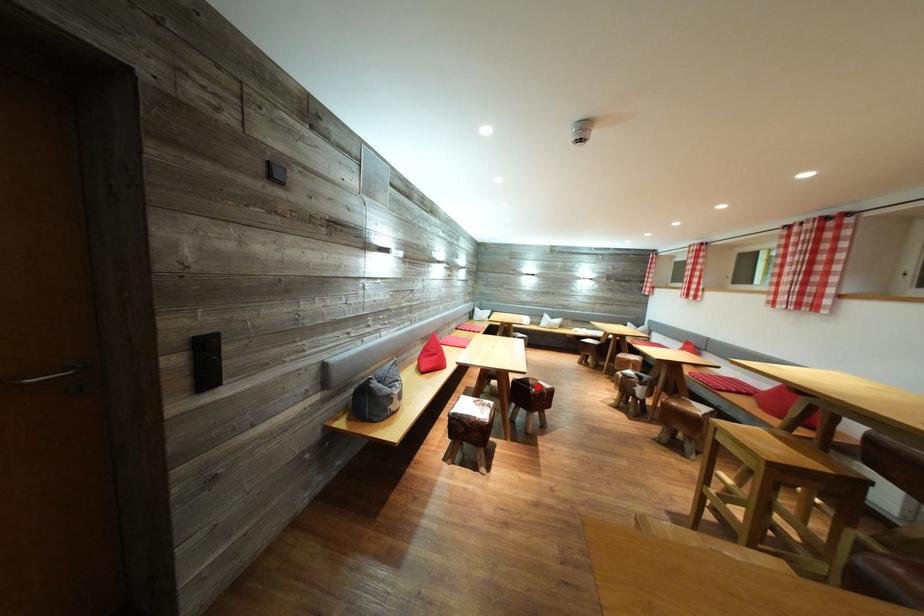
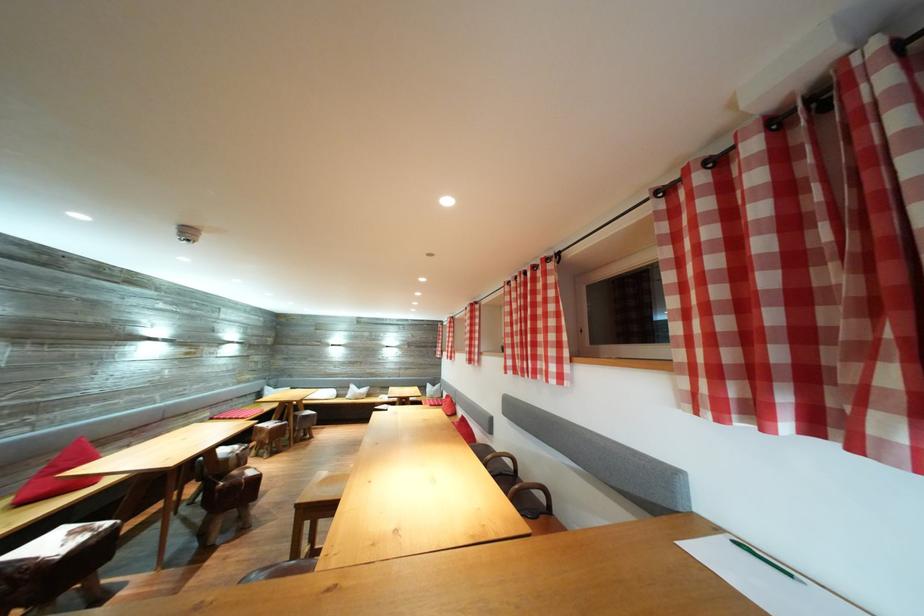
Locate, in the second image, the point that corresponds to the highlighted location in the first image.

(241, 477)